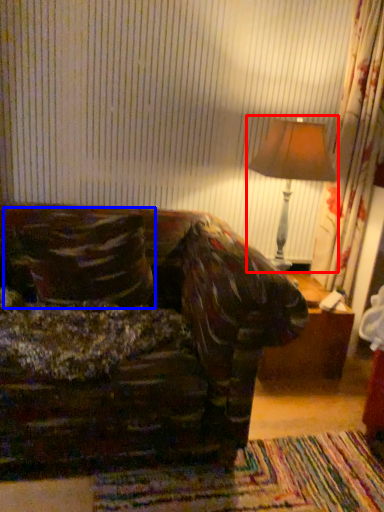
Question: Among these objects, which one is farthest to the camera, table lamp (highlighted by a red box) or throw pillow (highlighted by a blue box)?

Choices:
 (A) table lamp
 (B) throw pillow

Answer: (A)